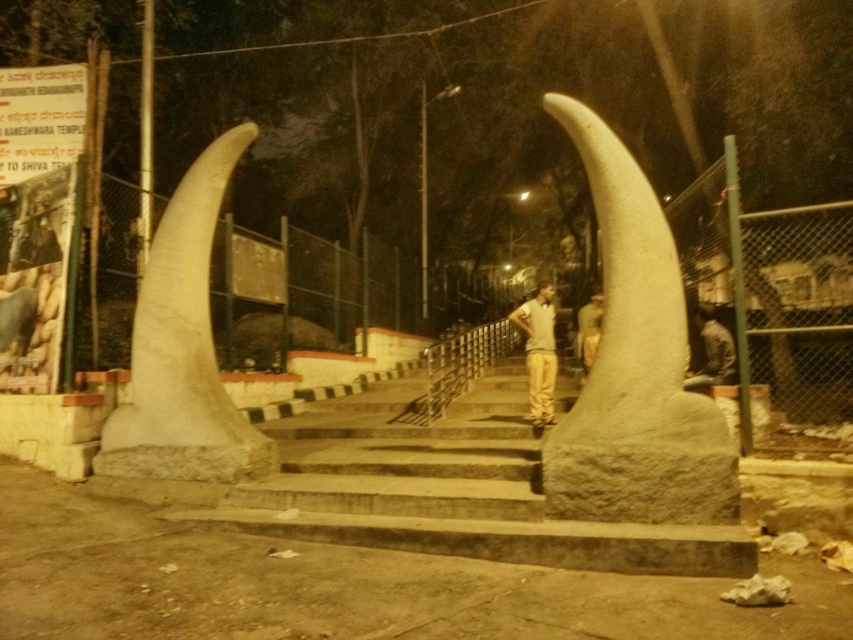
Does light beige pants at center lie in front of green fabric uniform at center?

Yes.

The image size is (853, 640). I want to click on light beige pants at center, so click(538, 352).

Measure the distance between point (550, 413) and camera.

7.17 meters

Locate an element on the screen. light beige pants at center is located at coordinates (538, 352).

Is white stone tusk at center below light beige pants at center?

No.

The width and height of the screenshot is (853, 640). What do you see at coordinates (635, 365) in the screenshot? I see `white stone tusk at center` at bounding box center [635, 365].

Locate an element on the screen. This screenshot has width=853, height=640. white stone tusk at center is located at coordinates (635, 365).

Is point (595, 404) closer to viewer compared to point (202, 436)?

That is True.

How distant is white stone tusk at center from white stone tusk at left?

white stone tusk at center is 2.74 meters away from white stone tusk at left.

Where is `white stone tusk at center`? white stone tusk at center is located at coordinates (635, 365).

At what (x,y) coordinates should I click in order to perform the action: click on white stone tusk at center. Please return your answer as a coordinate pair (x, y). The height and width of the screenshot is (640, 853). Looking at the image, I should click on (635, 365).